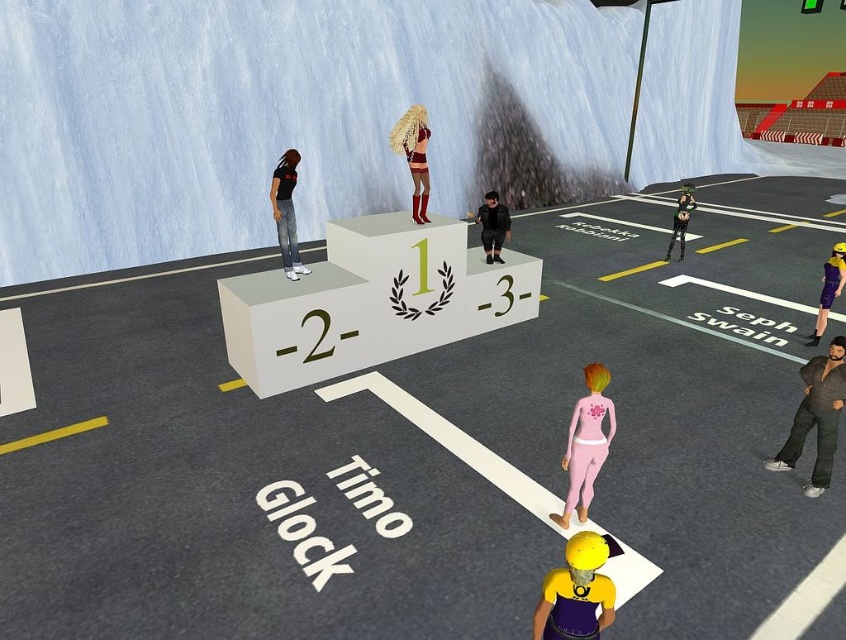
You are a fashion designer observing a runway show. You notice the shiny metallic dress at center and the black matte pants at center on the model. If the runway is 2 meters wide, can you fit both items side by side on the model without overlapping?

The shiny metallic dress at center and black matte pants at center are 1.84 meters apart, so yes, they can fit side by side on the model within the 2 meter runway width since 1.84 meters is less than 2 meters.

You are a fashion designer observing a runway show. You notice the shiny metallic dress at center and the black matte pants at center. Which clothing item is covering the other one?

The shiny metallic dress at center is positioned over the black matte pants at center, so the dress is covering the pants.